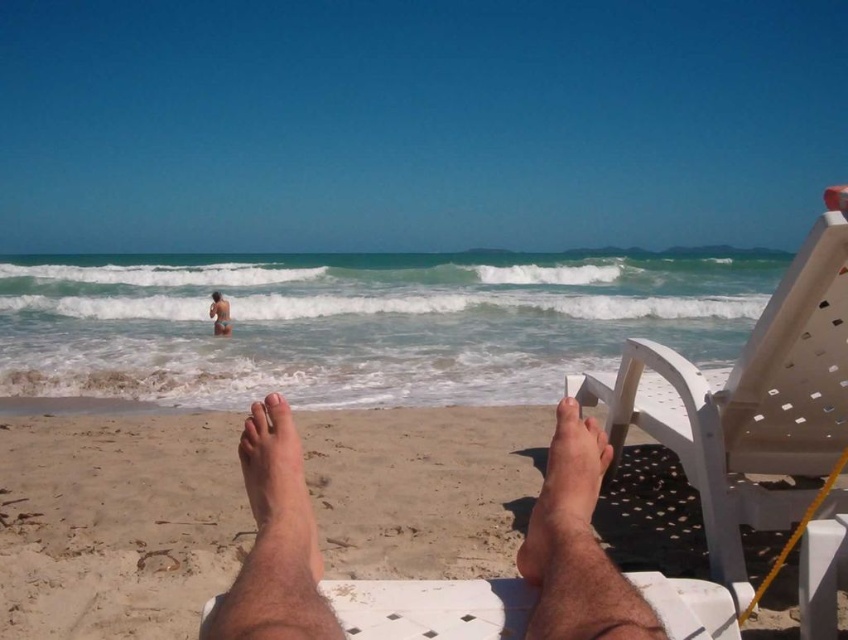
Question: Which point is closer to the camera?

Choices:
 (A) pale skin at center
 (B) hairless skin at center
 (C) skinny bikini at lower center
 (D) dry skin at center

Answer: (B)

Question: Which object appears closest to the camera in this image?

Choices:
 (A) pale skin at center
 (B) hairless skin at center

Answer: (B)

Question: Is white plastic beach chair at lower right below skinny bikini at lower center?

Choices:
 (A) yes
 (B) no

Answer: (A)

Question: Is white plastic beach chair at lower right further to the viewer compared to dry skin at center?

Choices:
 (A) no
 (B) yes

Answer: (B)

Question: Which of these objects is positioned closest to the skinny bikini at lower center?

Choices:
 (A) hairless skin at center
 (B) pale skin at center
 (C) white plastic beach chair at lower right

Answer: (C)

Question: Is dry skin at center to the right of pale skin at center from the viewer's perspective?

Choices:
 (A) no
 (B) yes

Answer: (B)